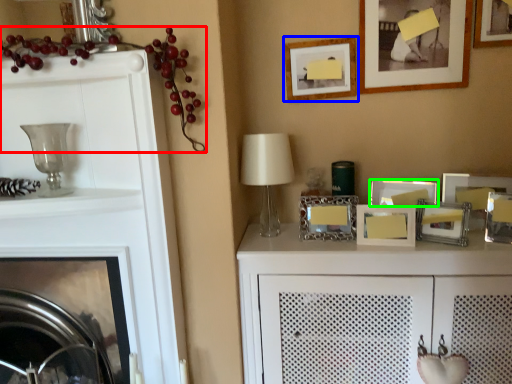
Question: Which is nearer to the fruit (highlighted by a red box)? picture frame (highlighted by a blue box) or picture frame (highlighted by a green box).

Choices:
 (A) picture frame
 (B) picture frame

Answer: (A)